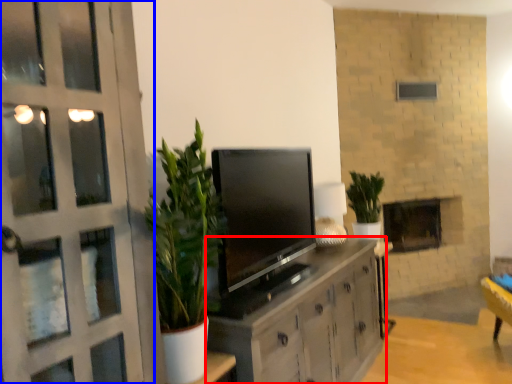
Question: Which of the following is the farthest to the observer, cabinetry (highlighted by a red box) or door (highlighted by a blue box)?

Choices:
 (A) cabinetry
 (B) door

Answer: (A)